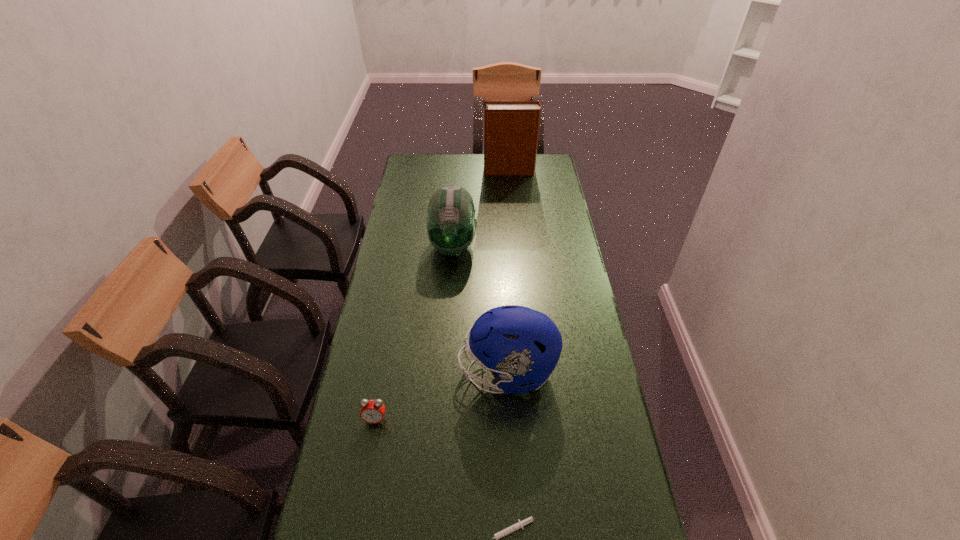
What are the coordinates of `free region located 0.200m on the face guard of the third farthest object` in the screenshot? It's located at (392, 372).

This screenshot has width=960, height=540. What are the coordinates of `vacant point located 0.120m on the face guard of the third farthest object` in the screenshot? It's located at (419, 372).

At what (x,y) coordinates should I click in order to perform the action: click on free space located on the visor of the second farthest object. Please return your answer as a coordinate pair (x, y). The image size is (960, 540). Looking at the image, I should click on (450, 284).

This screenshot has height=540, width=960. I want to click on vacant region located on the front-facing side of the fourth tallest object, so click(x=365, y=474).

You are a GUI agent. You are given a task and a screenshot of the screen. Output one action in this format:
    pyautogui.click(x=<x>, y=<y>)
    Task: Click on the object positioned at the far edge
    The image size is (960, 540).
    Given the screenshot: What is the action you would take?
    pyautogui.click(x=511, y=128)

Find the location of a particular element. object present at the left edge is located at coordinates (372, 411).

The height and width of the screenshot is (540, 960). In order to click on hardback book that is at the right edge in this screenshot , I will do `click(511, 128)`.

Identify the location of football helmet at the right edge. Image resolution: width=960 pixels, height=540 pixels. (520, 345).

At what (x,y) coordinates should I click in order to perform the action: click on object situated at the far right corner. Please return your answer as a coordinate pair (x, y). This screenshot has width=960, height=540. Looking at the image, I should click on (511, 128).

The width and height of the screenshot is (960, 540). What are the coordinates of `vacant area at the far edge of the desktop` in the screenshot? It's located at (464, 178).